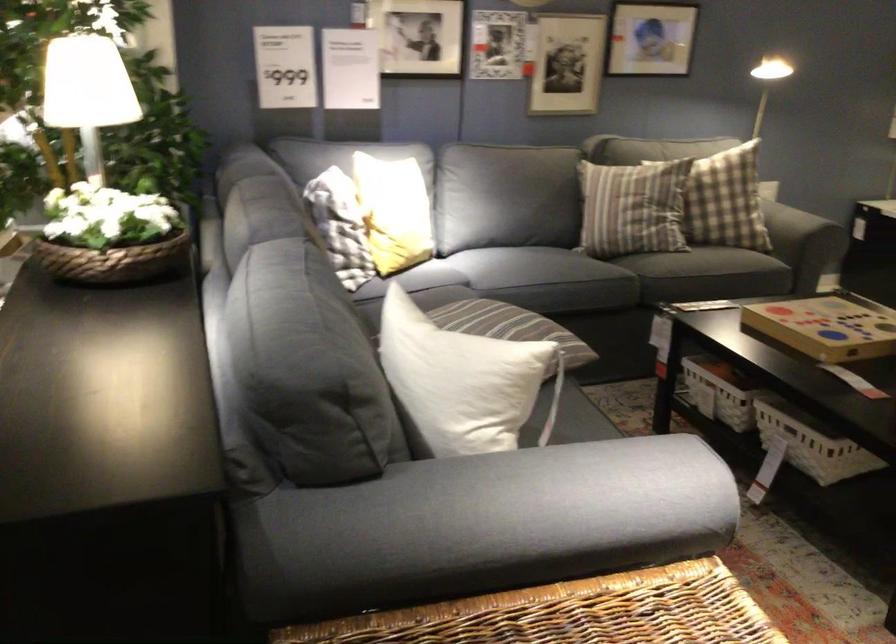
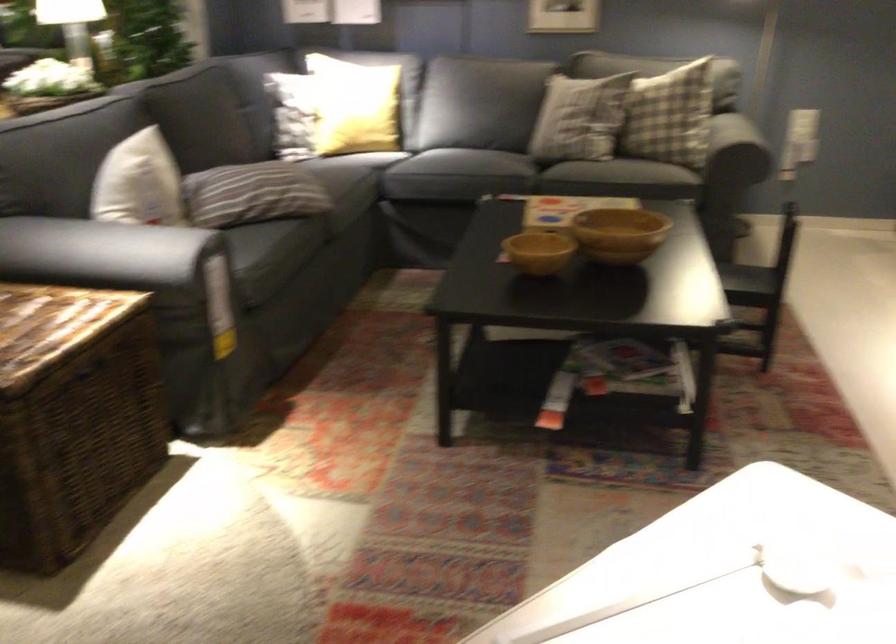
Question: I am providing you with two images of the same scene from different viewpoints. Please identify which objects are invisible in image2.

Choices:
 (A) plastic produce bag
 (B) wicker trunk lid
 (C) black chair sitting surface
 (D) plaid throw pillow

Answer: (D)